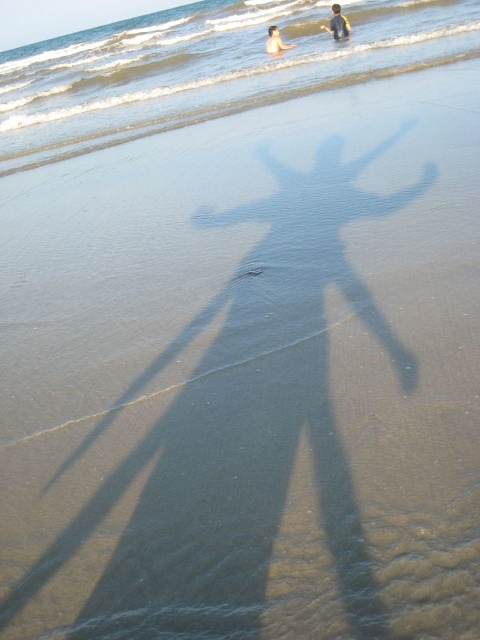
You are a photographer trying to capture the yellow fabric shirt at upper center in your shot. You want to ensure it appears in the upper third of the frame. Based on its current position at point 0.039, 0.704, will it be within the desired area?

The yellow fabric shirt at upper center is located at point (337, 24). Since the upper third of the frame typically spans from the top of the image down to approximately one third of the height, the shirt is positioned within this area and will be captured in the upper third.

You are a photographer standing on the beach and want to take a photo of the clear water at center and the smooth skin person at upper center. Which object will appear larger in the photo?

The clear water at center will appear larger in the photo because it is closer to the viewer than the smooth skin person at upper center.

You are a photographer trying to capture the scene from the shore. You want to ensure that the clear water at center and the yellow fabric shirt at upper center are both visible in your shot. Given their relative heights, which object will appear larger in the photo?

The clear water at center is taller than the yellow fabric shirt at upper center, so it will appear larger in the photo.